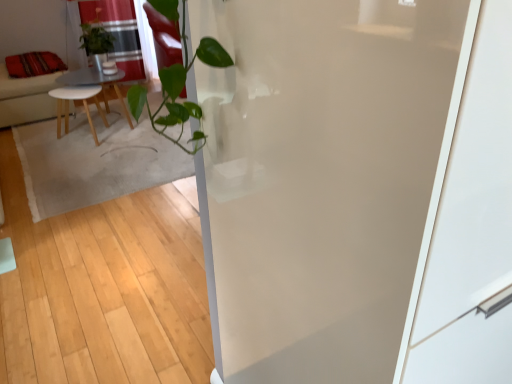
Question: Is transparent glass screen door at center turned away from red fabric cushion at left?

Choices:
 (A) yes
 (B) no

Answer: (B)

Question: Considering the relative sizes of transparent glass screen door at center and red fabric cushion at left in the image provided, is transparent glass screen door at center shorter than red fabric cushion at left?

Choices:
 (A) no
 (B) yes

Answer: (B)

Question: Is transparent glass screen door at center bigger than red fabric cushion at left?

Choices:
 (A) no
 (B) yes

Answer: (B)

Question: Is transparent glass screen door at center thinner than red fabric cushion at left?

Choices:
 (A) no
 (B) yes

Answer: (A)

Question: Can you confirm if transparent glass screen door at center is smaller than red fabric cushion at left?

Choices:
 (A) no
 (B) yes

Answer: (A)

Question: Could you tell me if transparent glass screen door at center is facing red fabric cushion at left?

Choices:
 (A) yes
 (B) no

Answer: (B)

Question: Can you confirm if transparent glass screen door at center is positioned to the left of velvet red pillow at upper left?

Choices:
 (A) yes
 (B) no

Answer: (B)

Question: From the image's perspective, is transparent glass screen door at center on velvet red pillow at upper left?

Choices:
 (A) no
 (B) yes

Answer: (A)

Question: Can we say transparent glass screen door at center lies outside velvet red pillow at upper left?

Choices:
 (A) no
 (B) yes

Answer: (B)

Question: Can you confirm if transparent glass screen door at center is thinner than velvet red pillow at upper left?

Choices:
 (A) no
 (B) yes

Answer: (A)

Question: From the image's perspective, does transparent glass screen door at center appear lower than velvet red pillow at upper left?

Choices:
 (A) yes
 (B) no

Answer: (A)

Question: Is transparent glass screen door at center at the right side of velvet red pillow at upper left?

Choices:
 (A) no
 (B) yes

Answer: (B)

Question: From the image's perspective, would you say wooden table at center is shown under red fabric cushion at left?

Choices:
 (A) no
 (B) yes

Answer: (B)